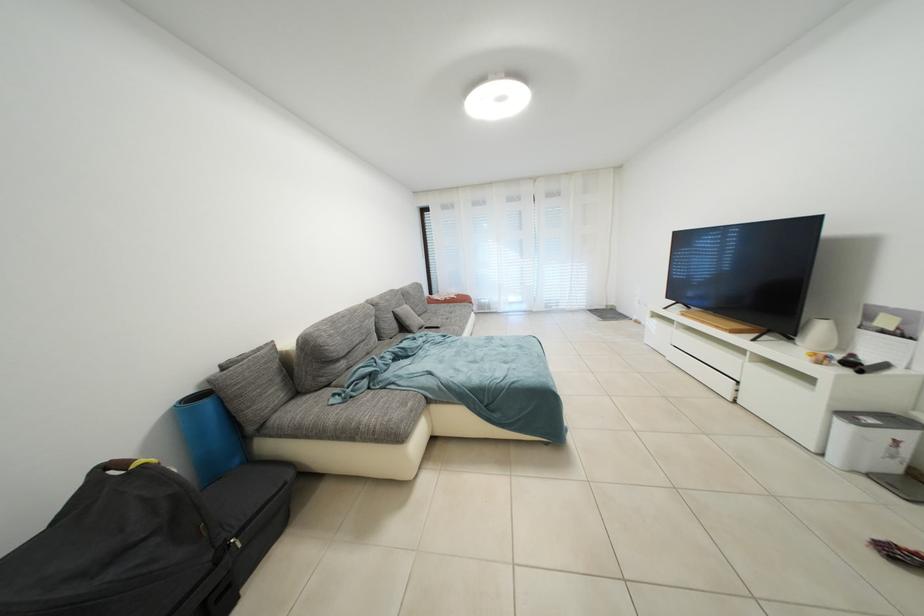
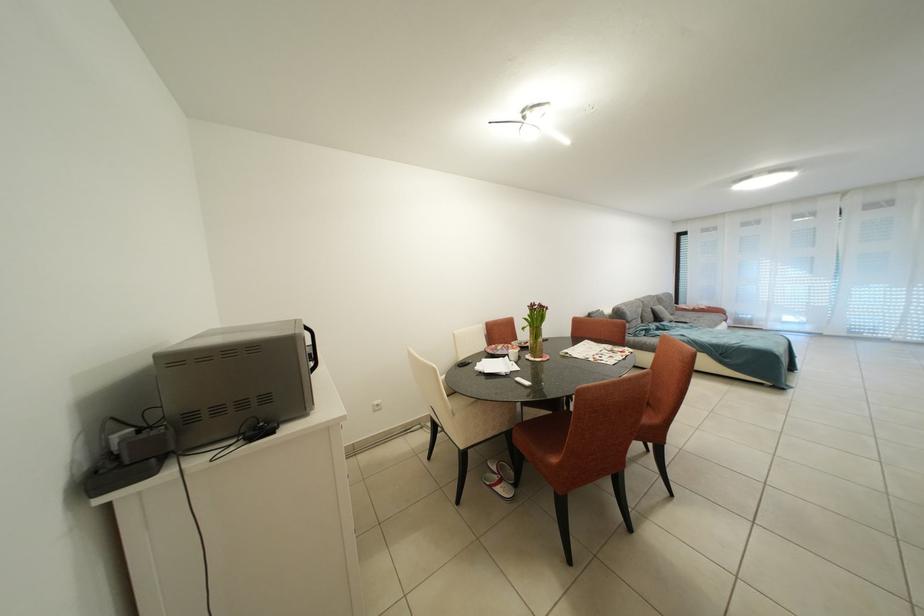
Where in the second image is the point corresponding to point (476, 323) from the first image?

(724, 330)